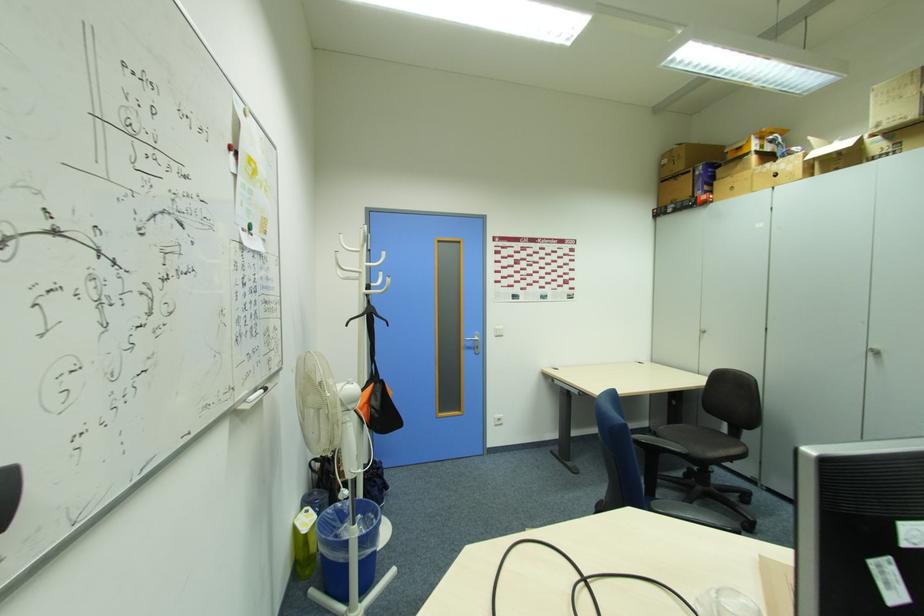
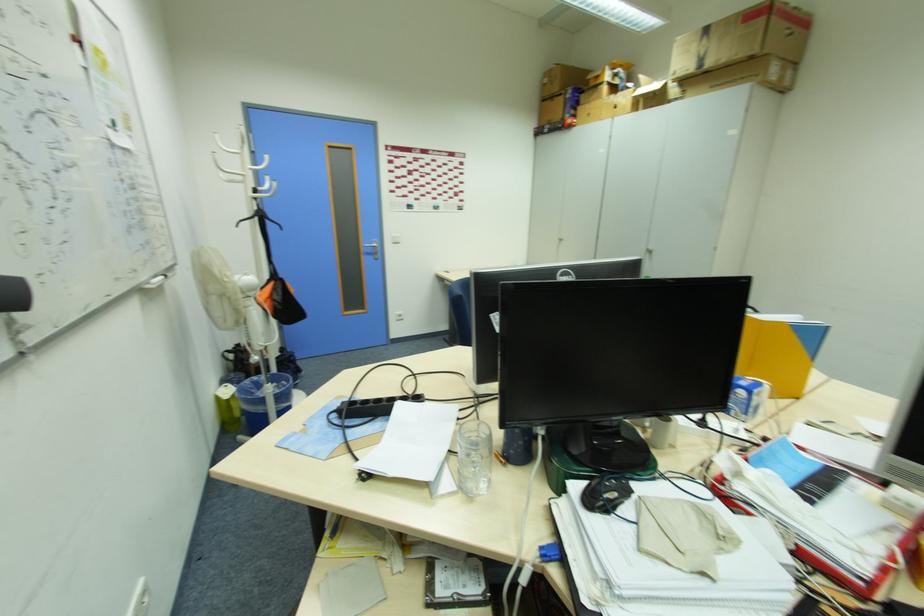
Where in the second image is the point corresponding to [889,123] from the first image?

(685, 71)